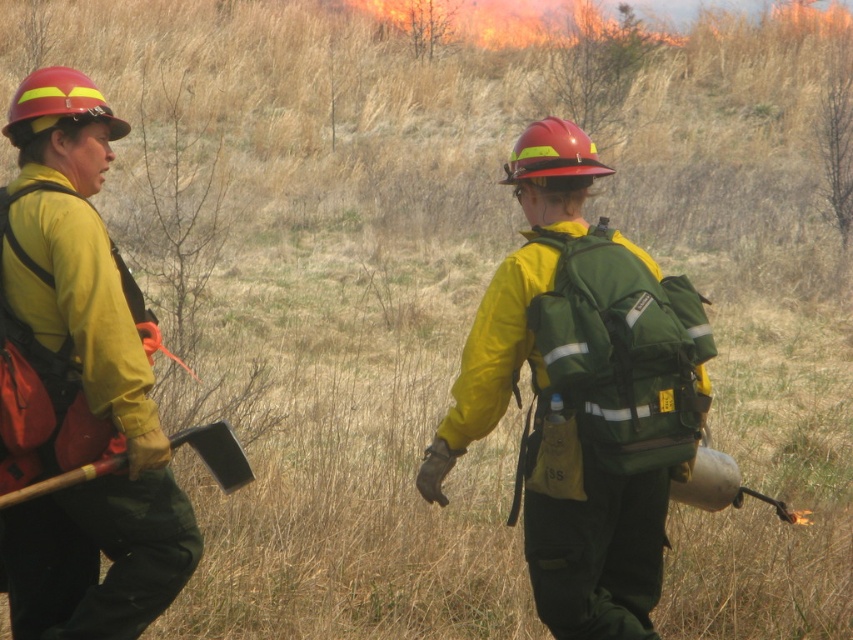
Between point (525, 552) and point (91, 461), which one is positioned in front?

Point (91, 461) is in front.

Locate an element on the screen. green fabric backpack at center is located at coordinates (579, 396).

Can you confirm if matte yellow jacket at left is positioned to the right of wooden handle axe at left?

In fact, matte yellow jacket at left is to the left of wooden handle axe at left.

Can you confirm if matte yellow jacket at left is shorter than wooden handle axe at left?

Incorrect, matte yellow jacket at left's height does not fall short of wooden handle axe at left's.

Which is behind, point (129, 326) or point (9, 493)?

Positioned behind is point (129, 326).

Locate an element on the screen. matte yellow jacket at left is located at coordinates (84, 385).

Is point (561, 460) positioned behind point (38, 173)?

No, it is in front of (38, 173).

Locate an element on the screen. The height and width of the screenshot is (640, 853). green fabric backpack at center is located at coordinates (579, 396).